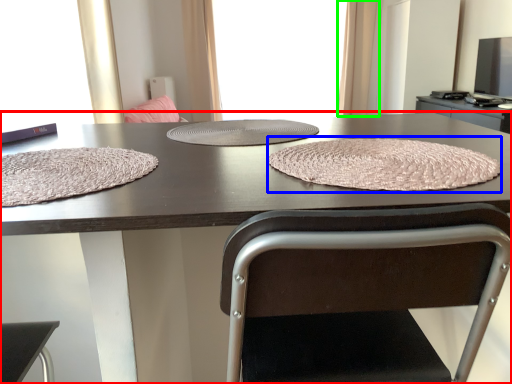
Question: Which object is positioned closest to table (highlighted by a red box)? Select from blanket (highlighted by a blue box) and curtain (highlighted by a green box).

Choices:
 (A) blanket
 (B) curtain

Answer: (A)